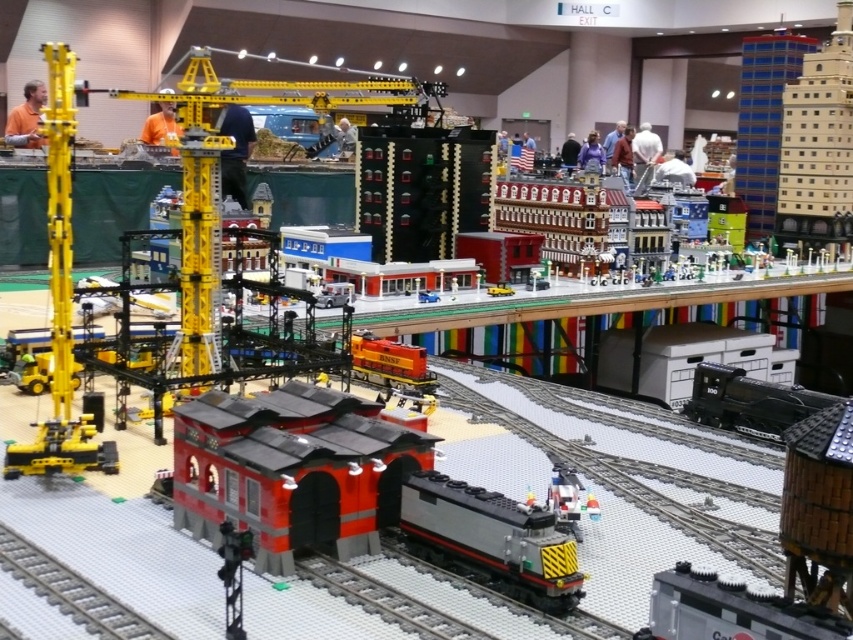
Is yellow plastic crane at left thinner than gray smooth train track at lower left?

Correct, yellow plastic crane at left's width is less than gray smooth train track at lower left's.

Between point (85, 456) and point (68, 593), which one is positioned behind?

The point (85, 456) is more distant.

Locate an element on the screen. The image size is (853, 640). yellow plastic crane at left is located at coordinates (61, 300).

Can you confirm if metallic silver train at center is positioned to the right of gray metallic train at center?

Incorrect, metallic silver train at center is not on the right side of gray metallic train at center.

Does metallic silver train at center have a greater width compared to gray metallic train at center?

Yes.

This screenshot has height=640, width=853. Identify the location of metallic silver train at center. (311, 474).

Where is `metallic silver train at center`? The height and width of the screenshot is (640, 853). metallic silver train at center is located at coordinates (311, 474).

Does point (51, 410) come farther from viewer compared to point (706, 579)?

Yes, it is behind point (706, 579).

Locate an element on the screen. yellow plastic crane at left is located at coordinates (61, 300).